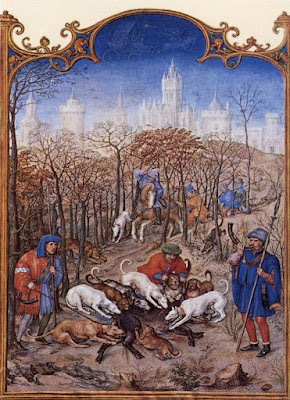
Find the location of a particular element. picture frame, intricate design on top is located at coordinates (2, 126), (288, 189), (121, 396), (140, 10), (45, 43), (249, 40).